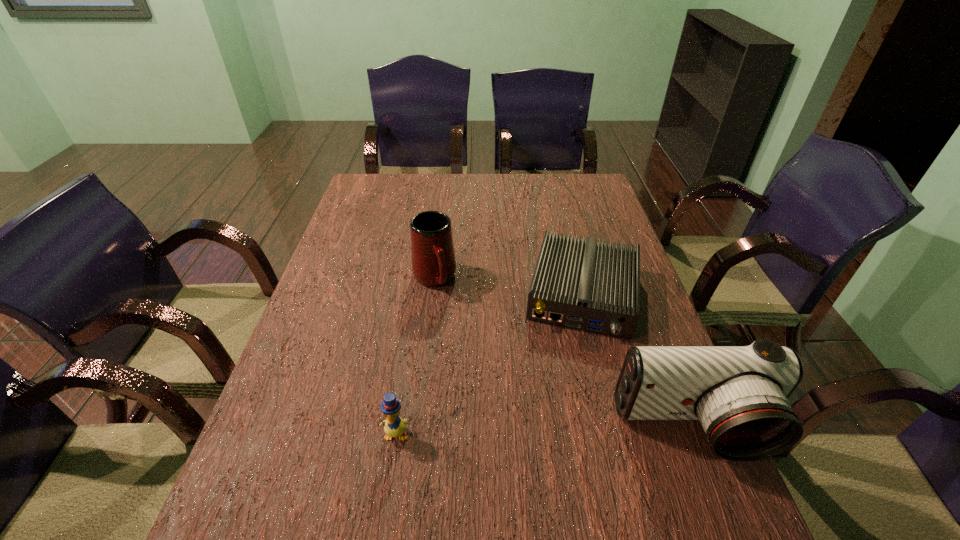
Locate an element on the screen. vacant space that satisfies the following two spatial constraints: 1. on the front side of the shortest object; 2. on the right side of the mug is located at coordinates (433, 295).